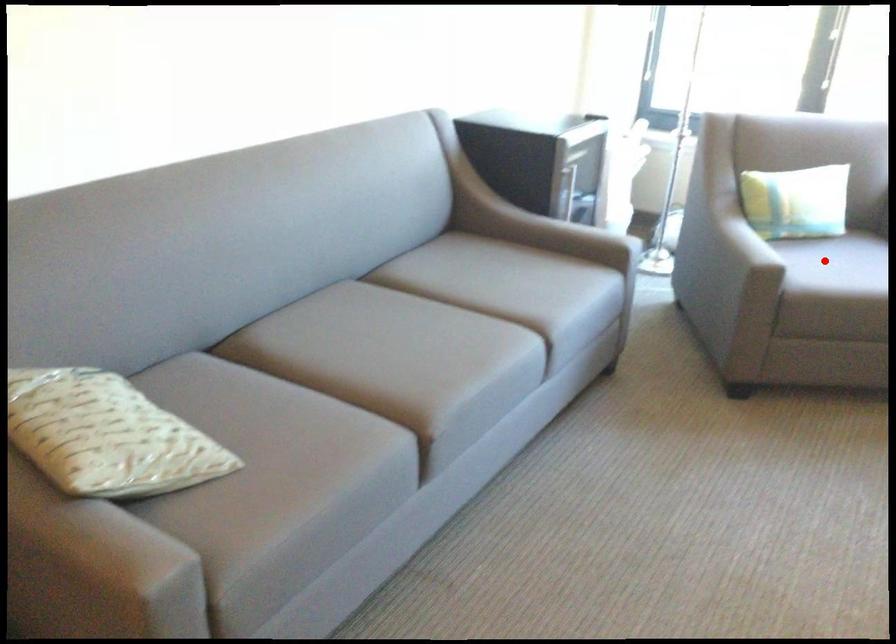
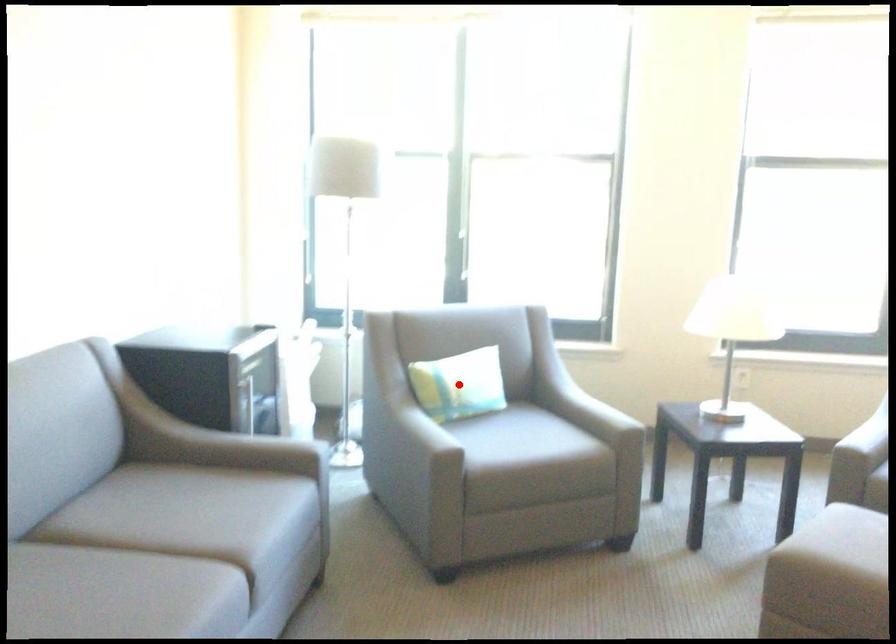
I am providing you with two images of the same scene from different viewpoints. A red point is marked on the first image and another point is marked on the second image. Are the points marked in image1 and image2 representing the same 3D position?

No